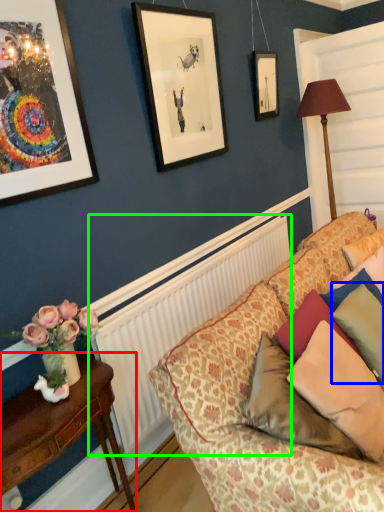
Question: Which object is the closest to the table (highlighted by a red box)? Choose among these: pillow (highlighted by a blue box) or radiator (highlighted by a green box).

Choices:
 (A) pillow
 (B) radiator

Answer: (B)